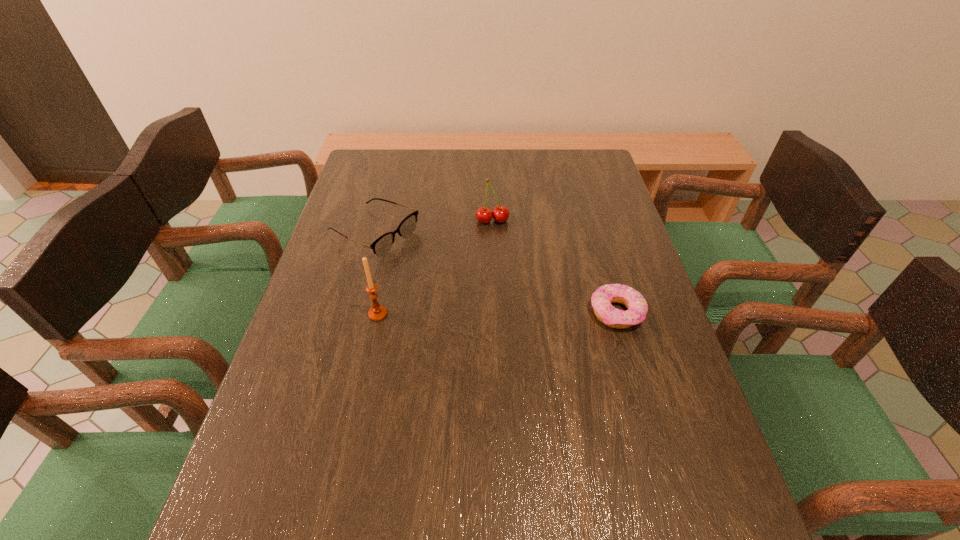
The height and width of the screenshot is (540, 960). I want to click on free spot located with the stems of the third shortest object pointing upwards, so click(515, 314).

The height and width of the screenshot is (540, 960). Find the location of `free space located on the face of the spectacles`. free space located on the face of the spectacles is located at coordinates (462, 277).

Locate an element on the screen. free space located 0.200m on the face of the spectacles is located at coordinates (465, 279).

Locate an element on the screen. The width and height of the screenshot is (960, 540). vacant space located on the face of the spectacles is located at coordinates (526, 309).

Where is `object located in the left edge section of the desktop`? object located in the left edge section of the desktop is located at coordinates (381, 246).

This screenshot has width=960, height=540. I want to click on object that is positioned at the right edge, so click(601, 299).

Image resolution: width=960 pixels, height=540 pixels. I want to click on blank space at the far edge of the desktop, so click(541, 174).

Where is `vacant region at the near edge of the desktop`? The height and width of the screenshot is (540, 960). vacant region at the near edge of the desktop is located at coordinates pyautogui.click(x=517, y=496).

The image size is (960, 540). In the image, there is a desktop. Identify the location of vacant space at the left edge. (278, 412).

Locate an element on the screen. Image resolution: width=960 pixels, height=540 pixels. free space at the right edge of the desktop is located at coordinates (638, 258).